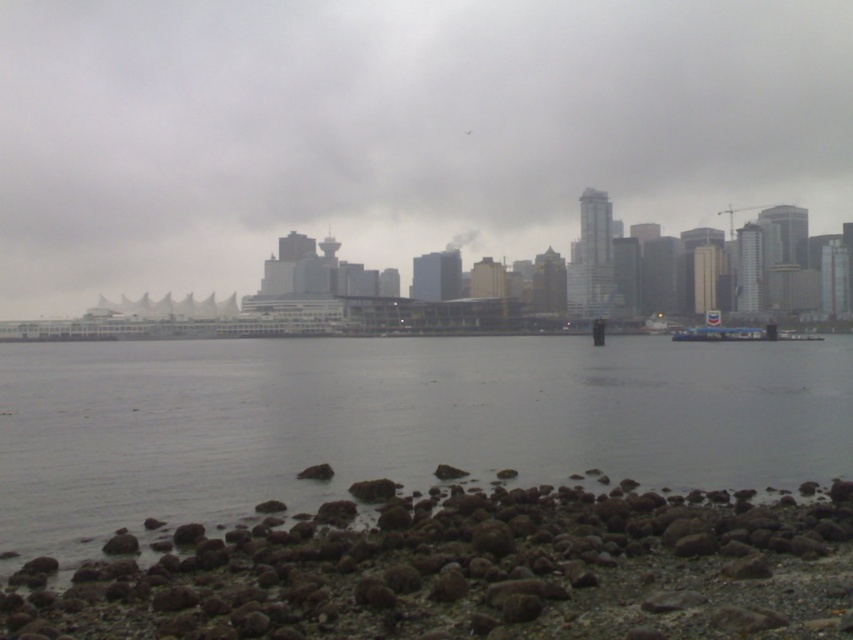
Which is behind, point (291, 115) or point (722, 333)?

The point (291, 115) is more distant.

Does matte gray sky at center have a lesser width compared to white plastic boat at lower right?

No, matte gray sky at center is not thinner than white plastic boat at lower right.

Is point (450, 13) more distant than point (791, 332)?

Yes, point (450, 13) is farther from viewer.

The image size is (853, 640). What are the coordinates of `matte gray sky at center` in the screenshot? It's located at (393, 131).

Who is positioned more to the left, gray water at center or white plastic boat at lower right?

Positioned to the left is gray water at center.

Find the location of `gray water at center`. gray water at center is located at coordinates (392, 422).

Image resolution: width=853 pixels, height=640 pixels. I want to click on gray water at center, so 392,422.

Can you confirm if gray water at center is wider than rusty gravel rocks at lower left?

Yes.

Who is positioned more to the right, gray water at center or rusty gravel rocks at lower left?

gray water at center

Is point (167, 476) positioned after point (280, 572)?

Yes, it is behind point (280, 572).

Locate an element on the screen. gray water at center is located at coordinates (392, 422).